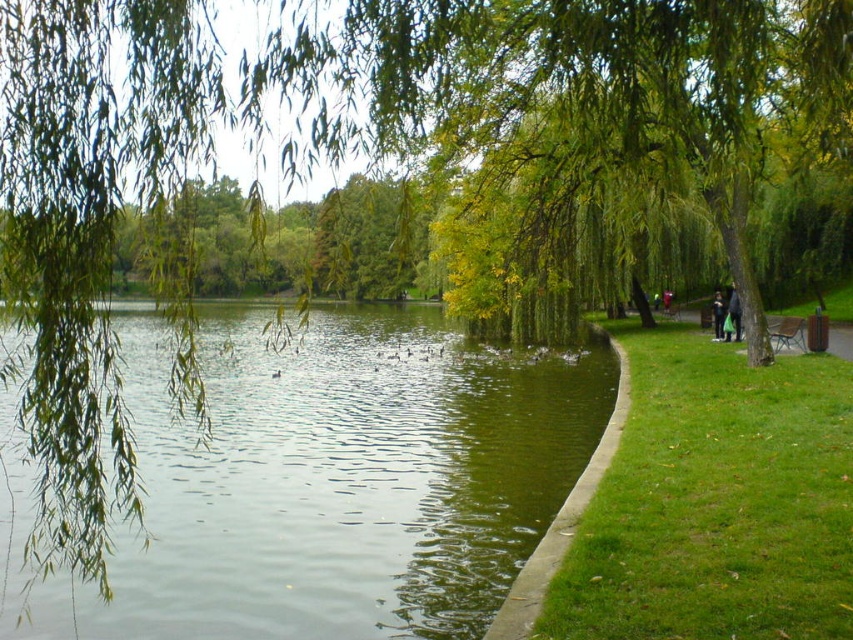
Based on the photo, you are standing at the entrance of the park and want to reach the green concrete path at lower center. According to the coordinates provided, in which direction should you walk to reach it?

The green concrete path at lower center is located at point [561,518]. Since the coordinates are given as x,y, where x increases to the right and y increases downward, you should walk towards the right and slightly downward from the entrance to reach the green concrete path at lower center.

You are a person standing on the paved pathway at the right side of the park. You want to sit down on the wooden park bench at right but first need to pass by the dark gray fabric jacket at right. Which object do you encounter first as you move towards the bench?

You will encounter the dark gray fabric jacket at right first because the wooden park bench at right is further away from you than the jacket.

You are standing at the entrance of the park and want to sit down to rest. You see the wooden park bench at right. Based on its coordinates, is it located closer to the water or the pathway?

The wooden park bench at right is located closer to the pathway because its coordinates are at point (787, 332), which places it near the right side of the image where the pathway is situated.